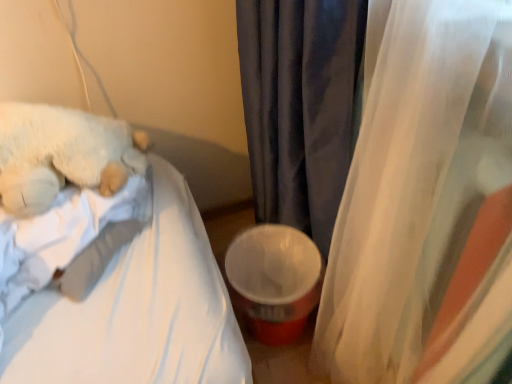
Question: Is translucent fabric curtain at right, the 2th curtain from the left, aimed at white soft fabric mattress at upper left?

Choices:
 (A) yes
 (B) no

Answer: (A)

Question: Does translucent fabric curtain at right, which ranks as the first curtain in right-to-left order, have a smaller size compared to white soft fabric mattress at upper left?

Choices:
 (A) yes
 (B) no

Answer: (A)

Question: Is translucent fabric curtain at right, the 2th curtain from the left, oriented away from white soft fabric mattress at upper left?

Choices:
 (A) no
 (B) yes

Answer: (A)

Question: Does translucent fabric curtain at right, the 2th curtain from the left, appear on the right side of white soft fabric mattress at upper left?

Choices:
 (A) yes
 (B) no

Answer: (A)

Question: Does translucent fabric curtain at right, the 2th curtain from the left, have a greater width compared to white soft fabric mattress at upper left?

Choices:
 (A) yes
 (B) no

Answer: (B)

Question: Is translucent fabric curtain at right, the 2th curtain from the left, behind white soft fabric mattress at upper left?

Choices:
 (A) yes
 (B) no

Answer: (B)

Question: Does velvet dark gray curtain at center, acting as the second curtain starting from the right, have a greater width compared to white soft fabric mattress at upper left?

Choices:
 (A) yes
 (B) no

Answer: (B)

Question: Is velvet dark gray curtain at center, acting as the second curtain starting from the right, to the right of white soft fabric mattress at upper left from the viewer's perspective?

Choices:
 (A) no
 (B) yes

Answer: (B)

Question: From a real-world perspective, is velvet dark gray curtain at center, acting as the second curtain starting from the right, beneath white soft fabric mattress at upper left?

Choices:
 (A) no
 (B) yes

Answer: (A)

Question: Is velvet dark gray curtain at center, acting as the second curtain starting from the right, shorter than white soft fabric mattress at upper left?

Choices:
 (A) yes
 (B) no

Answer: (B)

Question: Does velvet dark gray curtain at center, acting as the 1th curtain starting from the left, appear on the left side of white soft fabric mattress at upper left?

Choices:
 (A) no
 (B) yes

Answer: (A)

Question: Can you confirm if velvet dark gray curtain at center, acting as the 1th curtain starting from the left, is positioned to the left of translucent fabric curtain at right, which ranks as the first curtain in right-to-left order?

Choices:
 (A) yes
 (B) no

Answer: (A)